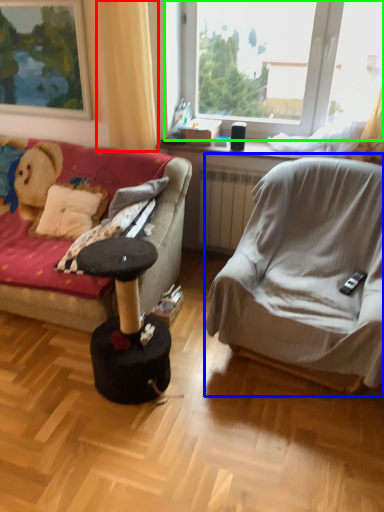
Question: Based on their relative distances, which object is nearer to curtain (highlighted by a red box)? Choose from chair (highlighted by a blue box) and window (highlighted by a green box).

Choices:
 (A) chair
 (B) window

Answer: (B)